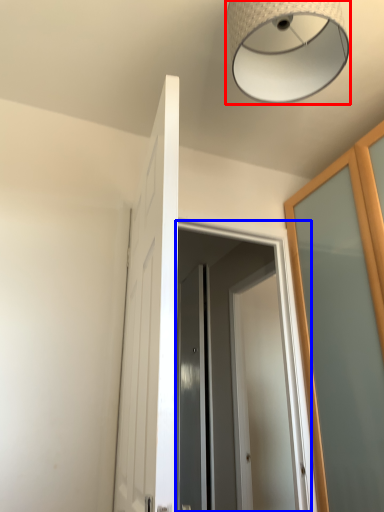
Question: Which object is closer to the camera taking this photo, lamp (highlighted by a red box) or screen door (highlighted by a blue box)?

Choices:
 (A) lamp
 (B) screen door

Answer: (A)